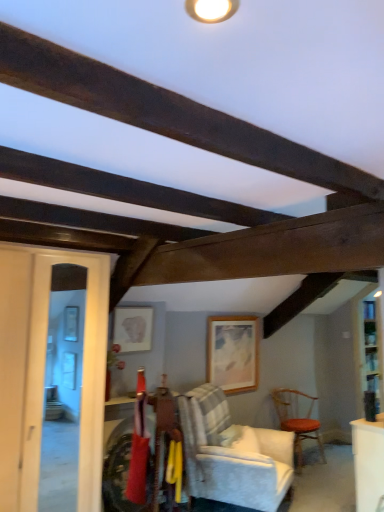
Question: Considering their positions, is matte red fabric at center located in front of or behind wooden textured chair at right, the 2th chair viewed from the left?

Choices:
 (A) behind
 (B) front

Answer: (B)

Question: From a real-world perspective, is matte red fabric at center physically located above or below wooden textured chair at right, the first chair positioned from the right?

Choices:
 (A) below
 (B) above

Answer: (B)

Question: Which is farther from the clear glass door at left?

Choices:
 (A) matte red fabric at center
 (B) dark wood beam at upper center
 (C) matte white picture frame at center, which ranks as the first picture frame in left-to-right order
 (D) wooden at center, which is counted as the first picture frame, starting from the back
 (E) wooden textured chair at right, marked as the second chair in a front-to-back arrangement

Answer: (E)

Question: Which of these objects is positioned farthest from the wooden at center, the first picture frame viewed from the right?

Choices:
 (A) wooden textured chair at right, marked as the second chair in a front-to-back arrangement
 (B) white upholstered chair at center, marked as the first chair in a front-to-back arrangement
 (C) dark wood beam at upper center
 (D) matte white picture frame at center, which ranks as the first picture frame in left-to-right order
 (E) matte red fabric at center

Answer: (C)